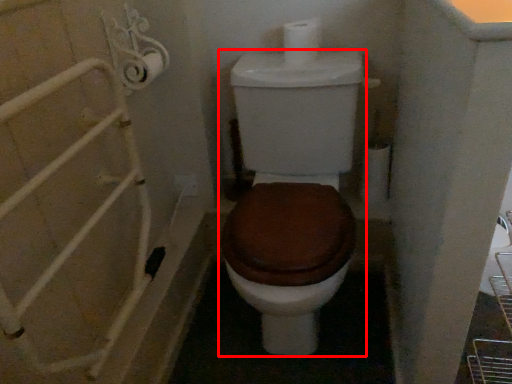
Question: From the image, what is the correct spatial relationship of toilet (annotated by the red box) in relation to toilet paper?

Choices:
 (A) right
 (B) left

Answer: (B)